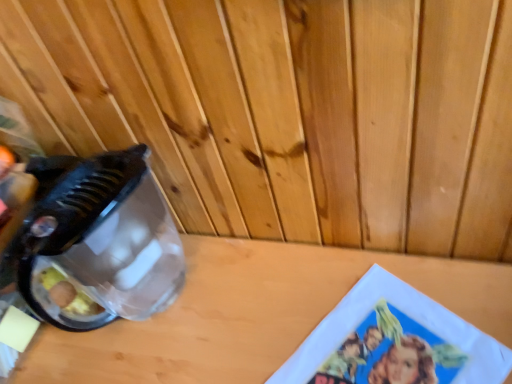
What do you see at coordinates (254, 313) in the screenshot?
I see `wooden table at center` at bounding box center [254, 313].

Where is `wooden table at center`? The image size is (512, 384). wooden table at center is located at coordinates (254, 313).

This screenshot has width=512, height=384. Find the location of `transparent plastic blender at left`. transparent plastic blender at left is located at coordinates (98, 241).

In order to face transparent plastic blender at left, should I rotate leftwards or rightwards?

It's best to rotate left around 17.406 degrees.

What do you see at coordinates (98, 241) in the screenshot? The height and width of the screenshot is (384, 512). I see `transparent plastic blender at left` at bounding box center [98, 241].

Find the location of a particular element. wooden table at center is located at coordinates (254, 313).

Is wooden table at center to the right of transparent plastic blender at left from the viewer's perspective?

Correct, you'll find wooden table at center to the right of transparent plastic blender at left.

Between wooden table at center and transparent plastic blender at left, which one is positioned behind?

transparent plastic blender at left.

Does point (261, 295) come farther from viewer compared to point (78, 264)?

No, it is in front of (78, 264).

From the image's perspective, which object appears higher, wooden table at center or transparent plastic blender at left?

transparent plastic blender at left is shown above in the image.

From a real-world perspective, who is located lower, wooden table at center or transparent plastic blender at left?

From a 3D spatial view, wooden table at center is below.

Looking at this image, which object is wider, wooden table at center or transparent plastic blender at left?

Wider between the two is wooden table at center.

Does wooden table at center have a greater height compared to transparent plastic blender at left?

Yes.

Can you confirm if wooden table at center is bigger than transparent plastic blender at left?

Indeed, wooden table at center has a larger size compared to transparent plastic blender at left.

Is wooden table at center located outside transparent plastic blender at left?

Indeed, wooden table at center is completely outside transparent plastic blender at left.

Is wooden table at center far away from transparent plastic blender at left?

No, wooden table at center is in close proximity to transparent plastic blender at left.

Is wooden table at center aimed at transparent plastic blender at left?

No, wooden table at center is not oriented towards transparent plastic blender at left.

How many degrees apart are the facing directions of wooden table at center and transparent plastic blender at left?

wooden table at center and transparent plastic blender at left are facing 0.307 degrees away from each other.

Where is `appliance above the wooden table at center (from the image's perspective)`? The image size is (512, 384). appliance above the wooden table at center (from the image's perspective) is located at coordinates (98, 241).

Considering the relative positions of transparent plastic blender at left and wooden table at center in the image provided, is transparent plastic blender at left to the left of wooden table at center from the viewer's perspective?

Correct, you'll find transparent plastic blender at left to the left of wooden table at center.

Looking at this image, considering the relative positions of transparent plastic blender at left and wooden table at center in the image provided, is transparent plastic blender at left behind wooden table at center?

Yes, transparent plastic blender at left is behind wooden table at center.

Is point (134, 150) closer to camera compared to point (281, 299)?

Yes, point (134, 150) is closer to viewer.

From the image's perspective, which object appears higher, transparent plastic blender at left or wooden table at center?

transparent plastic blender at left appears higher in the image.

From a real-world perspective, which is physically below, transparent plastic blender at left or wooden table at center?

From a 3D spatial view, wooden table at center is below.

Considering the relative sizes of transparent plastic blender at left and wooden table at center in the image provided, is transparent plastic blender at left wider than wooden table at center?

No.

From their relative heights in the image, would you say transparent plastic blender at left is taller or shorter than wooden table at center?

Clearly, transparent plastic blender at left is shorter compared to wooden table at center.

Considering the sizes of objects transparent plastic blender at left and wooden table at center in the image provided, who is bigger, transparent plastic blender at left or wooden table at center?

wooden table at center is bigger.

Is wooden table at center completely or partially inside transparent plastic blender at left?

No, wooden table at center is not a part of transparent plastic blender at left.

Does transparent plastic blender at left touch wooden table at center?

No, transparent plastic blender at left is not in contact with wooden table at center.

Does transparent plastic blender at left turn towards wooden table at center?

No, transparent plastic blender at left is not oriented towards wooden table at center.

How distant is transparent plastic blender at left from wooden table at center?

The distance of transparent plastic blender at left from wooden table at center is 5.92 inches.

I want to click on table top located below the transparent plastic blender at left (from the image's perspective), so point(254,313).

At what (x,y) coordinates should I click in order to perform the action: click on appliance located behind the wooden table at center. Please return your answer as a coordinate pair (x, y). This screenshot has width=512, height=384. Looking at the image, I should click on (x=98, y=241).

You are a GUI agent. You are given a task and a screenshot of the screen. Output one action in this format:
    pyautogui.click(x=<x>, y=<y>)
    Task: Click on the table top below the transparent plastic blender at left (from the image's perspective)
    This screenshot has height=384, width=512.
    Given the screenshot: What is the action you would take?
    pyautogui.click(x=254, y=313)